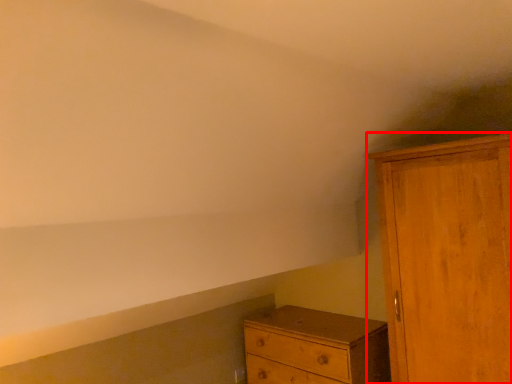
Question: From the image's perspective, considering the relative positions of cupboard (annotated by the red box) and chest of drawers in the image provided, where is cupboard (annotated by the red box) located with respect to the staircase?

Choices:
 (A) above
 (B) below

Answer: (A)